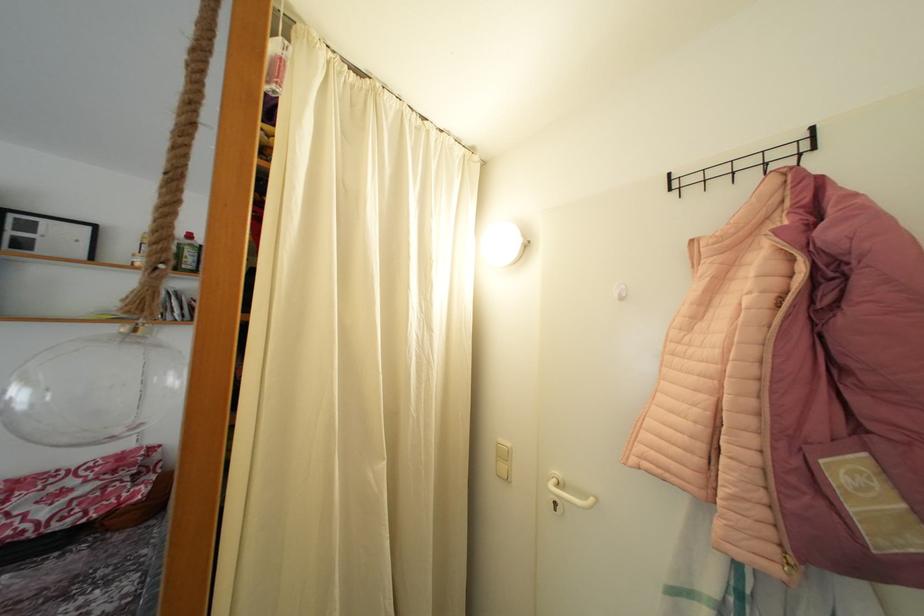
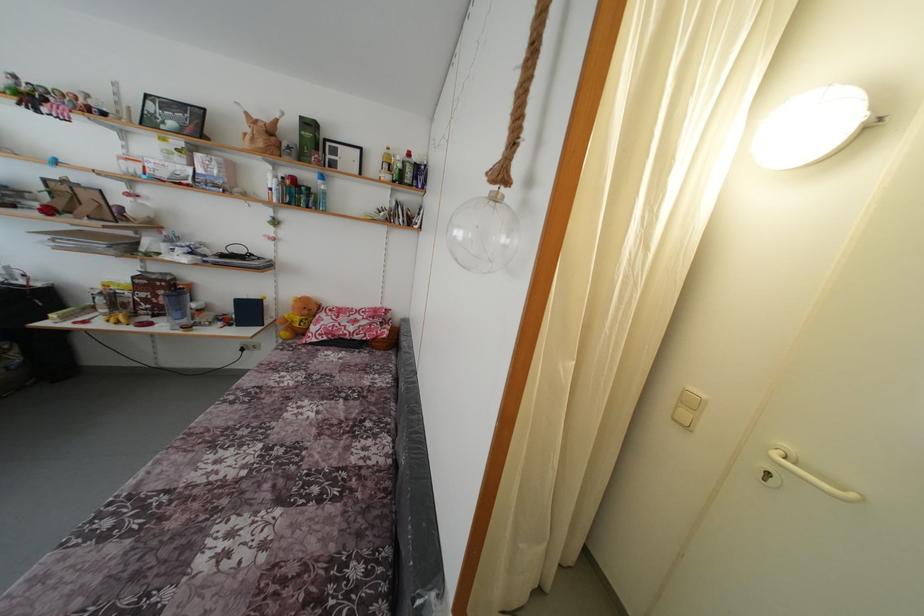
In the second image, find the point that corresponds to pixel 505 446 in the first image.

(696, 394)